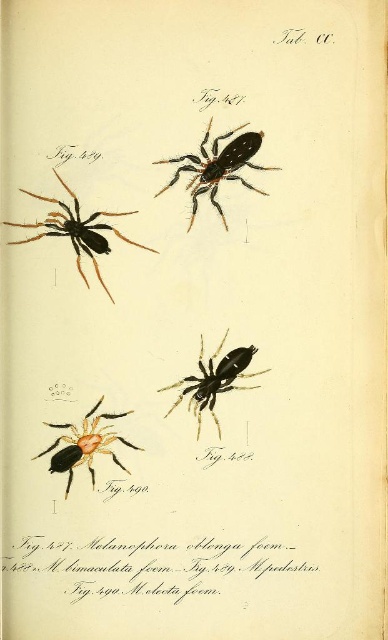
You are an entomologist examining the page labeled Tab. 60. You need to locate the black matte spider at center and the orange matte spider at lower left. Based on their positions, which spider is positioned higher on the page?

The black matte spider at center is positioned higher on the page than the orange matte spider at lower left because it is located above it.

You are examining the scientific illustration of spiders in Tab. 60. There are two points marked on the page at coordinates point (249, 355) and point (81, 456). If you were to move your finger from one point to the other along the page, which direction would you move your finger towards?

You would move your finger towards the lower right direction because point (81, 456) is closer to the camera than point (249, 355), meaning it is positioned lower and further to the right on the page.

You are an entomologist examining the page labeled Tab. 60. You need to determine which spider illustration is bigger between the black matte spider at upper center and the orange matte spider at lower left. Based on the page, which one is larger?

The black matte spider at upper center is larger compared to the orange matte spider at lower left.